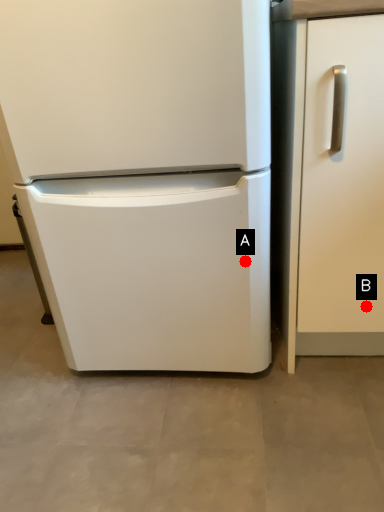
Question: Two points are circled on the image, labeled by A and B beside each circle. Which point is closer to the camera taking this photo?

Choices:
 (A) A is closer
 (B) B is closer

Answer: (A)